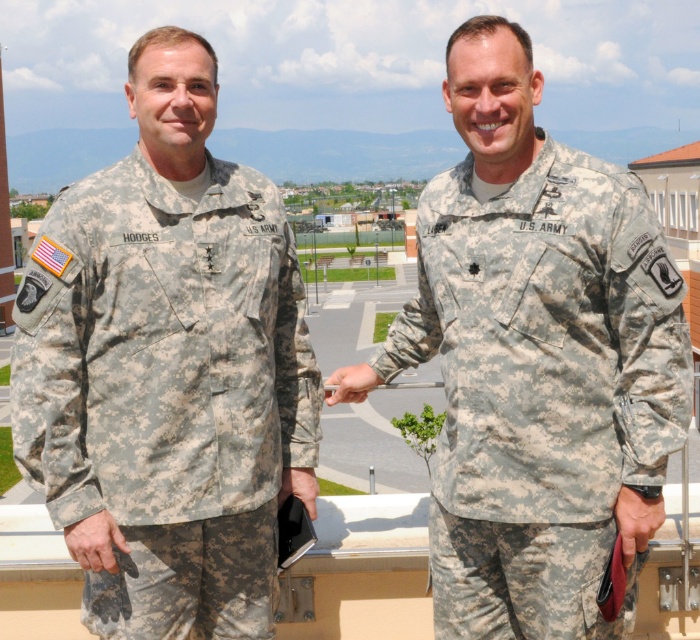
You are a photographer trying to capture a clear photo of both the camouflage fabric uniform at left and the camouflage fabric uniform at right. Since you want both subjects to be in focus, which one should you adjust your camera focus on first?

The camouflage fabric uniform at left is in front of the camouflage fabric uniform at right, so you should focus on the camouflage fabric uniform at left first to ensure both are in focus.